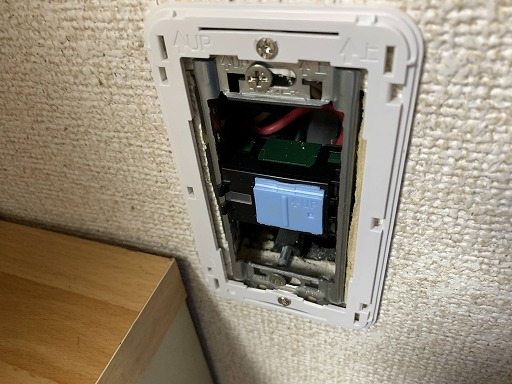
Image resolution: width=512 pixels, height=384 pixels. I want to click on white cabinet, so click(x=185, y=309), click(x=203, y=360), click(x=208, y=375), click(x=178, y=377), click(x=180, y=344), click(x=144, y=377), click(x=167, y=337).